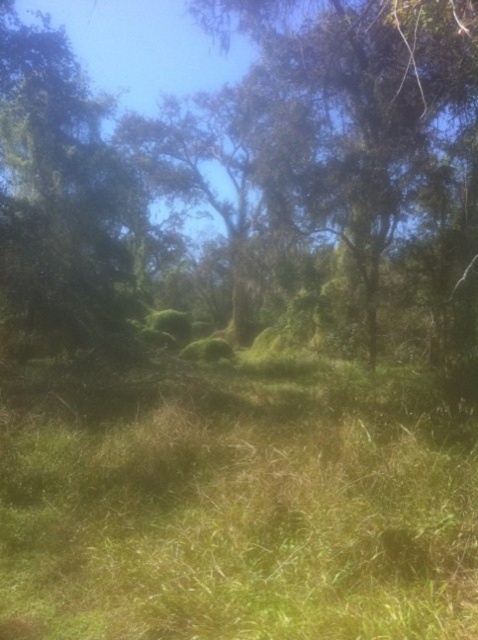
Can you confirm if green grass at center is smaller than green mossy tree at center?

Yes, green grass at center is smaller than green mossy tree at center.

What do you see at coordinates (236, 502) in the screenshot? I see `green grass at center` at bounding box center [236, 502].

Who is more distant from viewer, (145, 444) or (403, 148)?

Positioned behind is point (403, 148).

Locate an element on the screen. green grass at center is located at coordinates (236, 502).